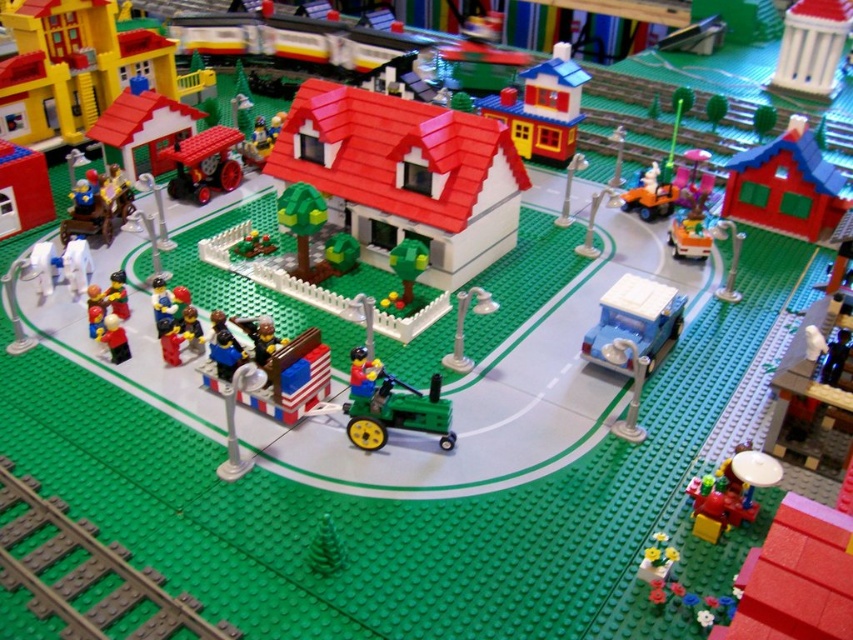
Measure the distance between smooth plastic house at right and matte red tractor at center.

A distance of 3.79 feet exists between smooth plastic house at right and matte red tractor at center.

What are the coordinates of `smooth plastic house at right` in the screenshot? It's located at (785, 186).

You are a GUI agent. You are given a task and a screenshot of the screen. Output one action in this format:
    pyautogui.click(x=<x>, y=<y>)
    Task: Click on the smooth plastic house at right
    
    Given the screenshot: What is the action you would take?
    pyautogui.click(x=785, y=186)

Locate an element on the screen. The image size is (853, 640). smooth plastic house at right is located at coordinates (785, 186).

In the scene shown: Which of these two, green plastic train track at bottom left or matte red tractor at center, stands taller?

matte red tractor at center is taller.

Can you confirm if green plastic train track at bottom left is bigger than matte red tractor at center?

Indeed, green plastic train track at bottom left has a larger size compared to matte red tractor at center.

Which is behind, point (45, 509) or point (204, 134)?

The point (204, 134) is more distant.

You are a GUI agent. You are given a task and a screenshot of the screen. Output one action in this format:
    pyautogui.click(x=<x>, y=<y>)
    Task: Click on the green plastic train track at bottom left
    This screenshot has height=640, width=853.
    Given the screenshot: What is the action you would take?
    pyautogui.click(x=85, y=573)

Does smooth plastic house at right have a greater width compared to light blue plastic car at center-right?

Indeed, smooth plastic house at right has a greater width compared to light blue plastic car at center-right.

Does smooth plastic house at right appear over light blue plastic car at center-right?

Indeed, smooth plastic house at right is positioned over light blue plastic car at center-right.

Who is more forward, [788,192] or [639,349]?

Positioned in front is point [639,349].

Find the location of `smooth plastic house at right`. smooth plastic house at right is located at coordinates click(785, 186).